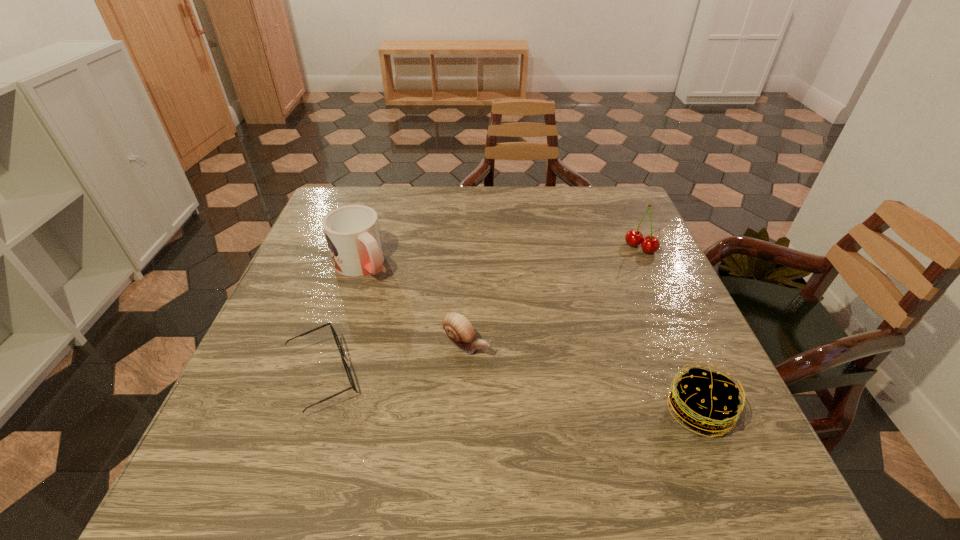
This screenshot has height=540, width=960. What are the coordinates of `the shortest object` in the screenshot? It's located at (337, 341).

At what (x,y) coordinates should I click in order to perform the action: click on the third tallest object. Please return your answer as a coordinate pair (x, y). Looking at the image, I should click on (705, 400).

The height and width of the screenshot is (540, 960). Identify the location of mug. (352, 232).

What are the coordinates of `cherry` in the screenshot? It's located at (649, 244).

Where is `escargot`? Image resolution: width=960 pixels, height=540 pixels. escargot is located at coordinates (458, 329).

The width and height of the screenshot is (960, 540). I want to click on the fourth tallest object, so [x=458, y=329].

Find the location of `free space located with the lenses facing outward on the shortest object`. free space located with the lenses facing outward on the shortest object is located at coordinates (418, 376).

Find the location of `vacant space located on the back of the patty`. vacant space located on the back of the patty is located at coordinates pyautogui.click(x=653, y=304).

Locate an element on the screen. This screenshot has width=960, height=540. vacant space located 0.400m on the side of the mug with the handle is located at coordinates (476, 388).

Where is `vacant space located on the side of the mug with the handle`? The width and height of the screenshot is (960, 540). vacant space located on the side of the mug with the handle is located at coordinates (415, 323).